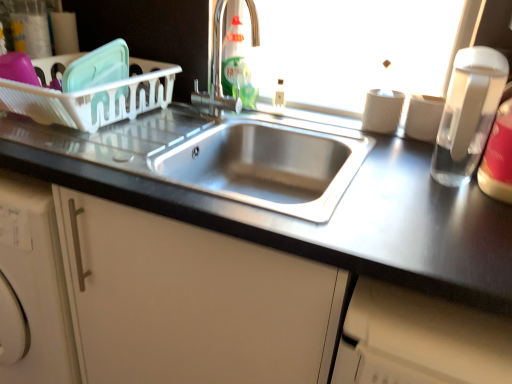
This screenshot has height=384, width=512. Identify the location of vacant space underneath satin nickel faucet at upper center (from a real-world perspective). (221, 116).